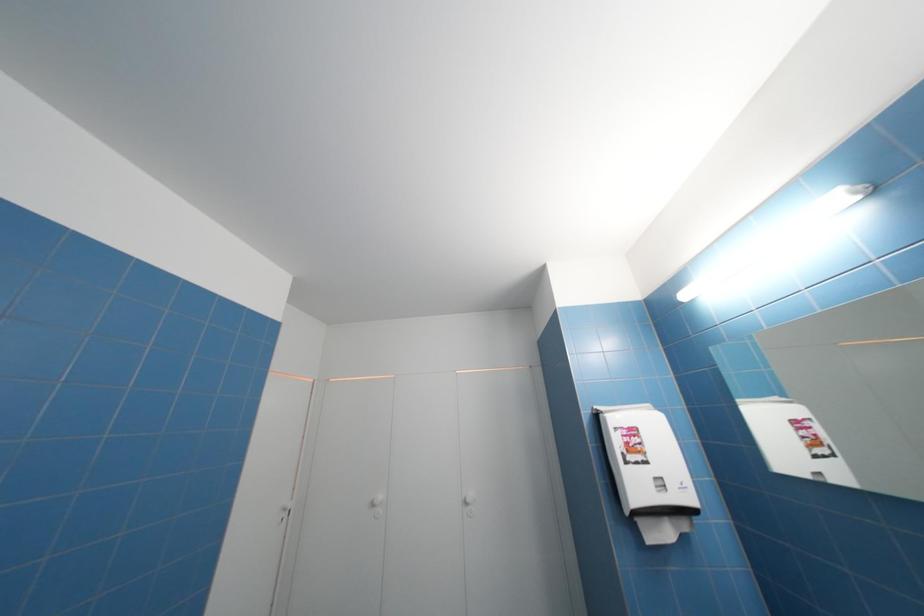
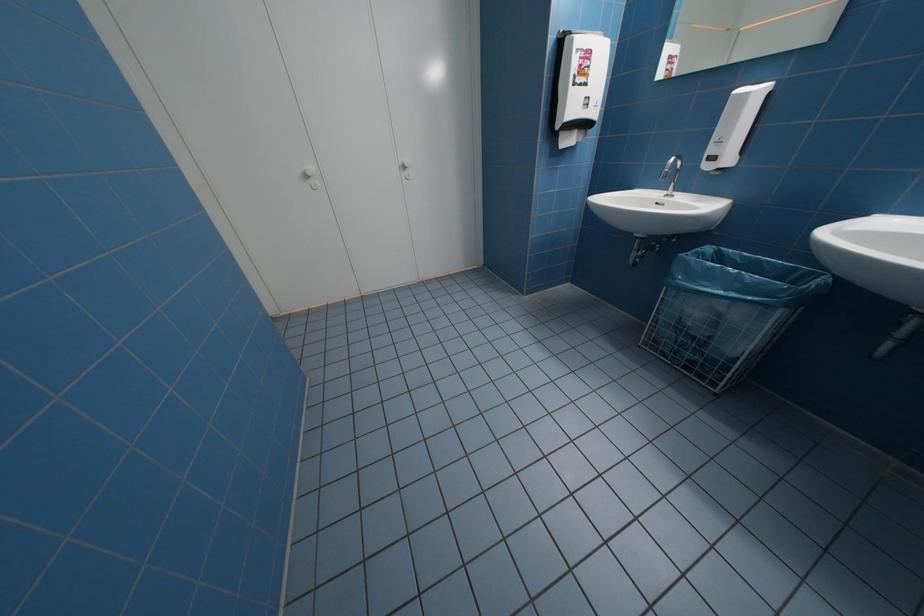
Based on the continuous images, in which direction is the camera rotating?

The rotation direction of the camera is right-down.